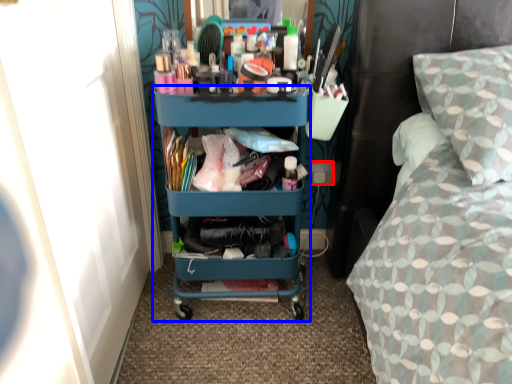
Question: Which object appears farthest to the camera in this image, power outlet (highlighted by a red box) or desk (highlighted by a blue box)?

Choices:
 (A) power outlet
 (B) desk

Answer: (A)